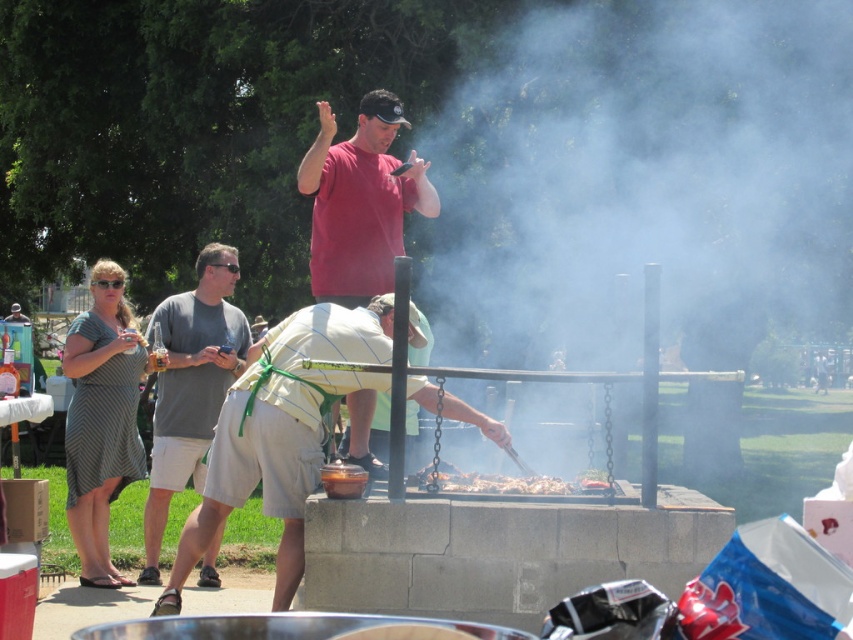
Is matte red shirt at center thinner than charcoal briquettes at center?

Correct, matte red shirt at center's width is less than charcoal briquettes at center's.

Is matte red shirt at center bigger than charcoal briquettes at center?

Indeed, matte red shirt at center has a larger size compared to charcoal briquettes at center.

Which is in front, point (328, 134) or point (531, 488)?

Positioned in front is point (531, 488).

Find the location of a particular element. The image size is (853, 640). matte red shirt at center is located at coordinates (360, 202).

Can you confirm if charcoal briquettes at center is taller than green rubber goggles at upper center?

Correct, charcoal briquettes at center is much taller as green rubber goggles at upper center.

Does charcoal briquettes at center appear on the left side of green rubber goggles at upper center?

In fact, charcoal briquettes at center is to the right of green rubber goggles at upper center.

You are a GUI agent. You are given a task and a screenshot of the screen. Output one action in this format:
    pyautogui.click(x=<x>, y=<y>)
    Task: Click on the charcoal briquettes at center
    The image size is (853, 640).
    Given the screenshot: What is the action you would take?
    pyautogui.click(x=502, y=483)

Where is `charcoal briquettes at center`? The height and width of the screenshot is (640, 853). charcoal briquettes at center is located at coordinates (502, 483).

Is point (178, 339) in front of point (207, 266)?

Yes, point (178, 339) is in front of point (207, 266).

Which is behind, point (155, 454) or point (231, 269)?

Point (231, 269)

In order to click on gray cotton t-shirt at left in this screenshot , I will do `click(190, 387)`.